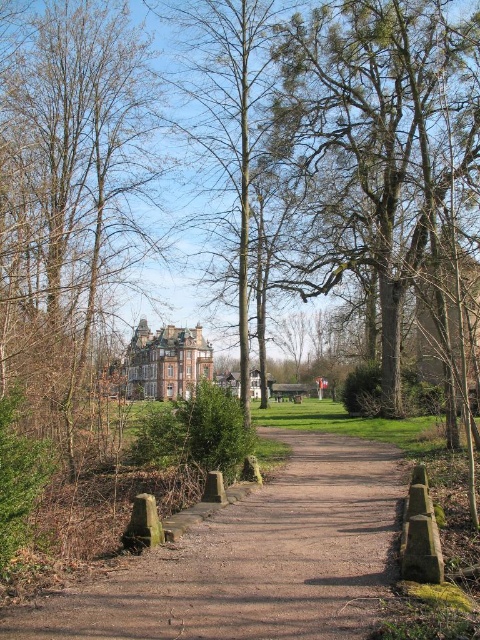
Is brown leafless tree at left to the right of dirt/gravel path at center from the viewer's perspective?

In fact, brown leafless tree at left is to the left of dirt/gravel path at center.

Which is more to the left, brown leafless tree at left or dirt/gravel path at center?

Positioned to the left is brown leafless tree at left.

What do you see at coordinates (71, 193) in the screenshot? This screenshot has height=640, width=480. I see `brown leafless tree at left` at bounding box center [71, 193].

Image resolution: width=480 pixels, height=640 pixels. I want to click on brown leafless tree at left, so click(x=71, y=193).

Between brown leafless tree at left and green leafy tree at center, which one is positioned lower?

Positioned lower is green leafy tree at center.

You are a GUI agent. You are given a task and a screenshot of the screen. Output one action in this format:
    pyautogui.click(x=<x>, y=<y>)
    Task: Click on the brown leafless tree at left
    This screenshot has width=480, height=640.
    Given the screenshot: What is the action you would take?
    pyautogui.click(x=71, y=193)

Looking at this image, is dirt/gravel path at center to the left of green leafy tree at center from the viewer's perspective?

Correct, you'll find dirt/gravel path at center to the left of green leafy tree at center.

Between dirt/gravel path at center and green leafy tree at center, which one has less height?

dirt/gravel path at center is shorter.

What do you see at coordinates (253, 561) in the screenshot? The height and width of the screenshot is (640, 480). I see `dirt/gravel path at center` at bounding box center [253, 561].

Where is `dirt/gravel path at center`? This screenshot has height=640, width=480. dirt/gravel path at center is located at coordinates (253, 561).